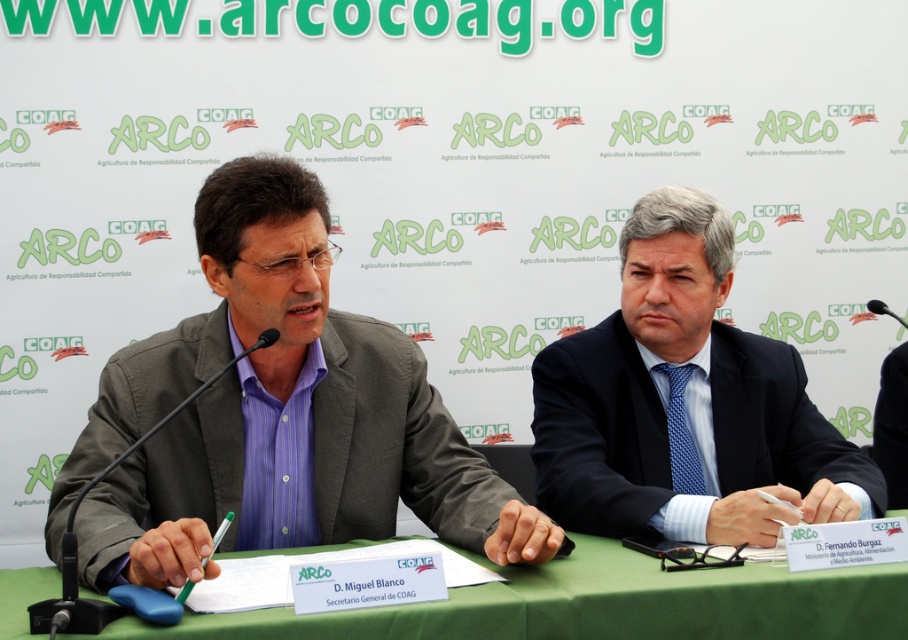
You are a photographer at the event and need to ensure that both the matte gray suit at center and the black plastic microphone at center are clearly visible in your photo. Given their sizes, which object should you focus on first to ensure proper framing?

The matte gray suit at center is larger in size than the black plastic microphone at center, so you should focus on the matte gray suit at center first to ensure proper framing.

You are a photographer at the event and want to take a photo of the dark blue suit at center and the black fabric suit at right. Which one will appear larger in the photo?

The dark blue suit at center will appear larger in the photo because it is closer to the viewer than the black fabric suit at right.

You are attending a press conference and want to hand a document to the speaker holding the matte gray suit at center. Since the black plastic microphone at center is in the way, can you slide the document underneath it?

The matte gray suit at center is below the black plastic microphone at center, so yes, you can slide the document underneath the black plastic microphone at center to reach the speaker.